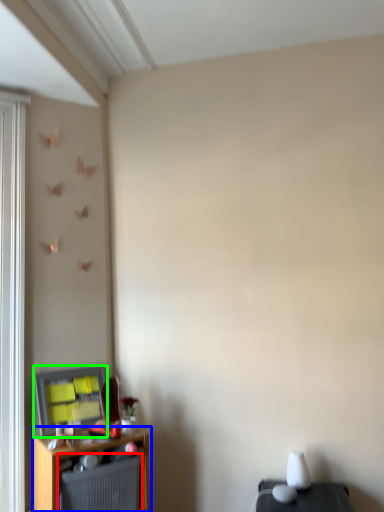
Question: Based on their relative distances, which object is nearer to radiator (highlighted by a red box)? Choose from shelf (highlighted by a blue box) and window screen (highlighted by a green box).

Choices:
 (A) shelf
 (B) window screen

Answer: (A)